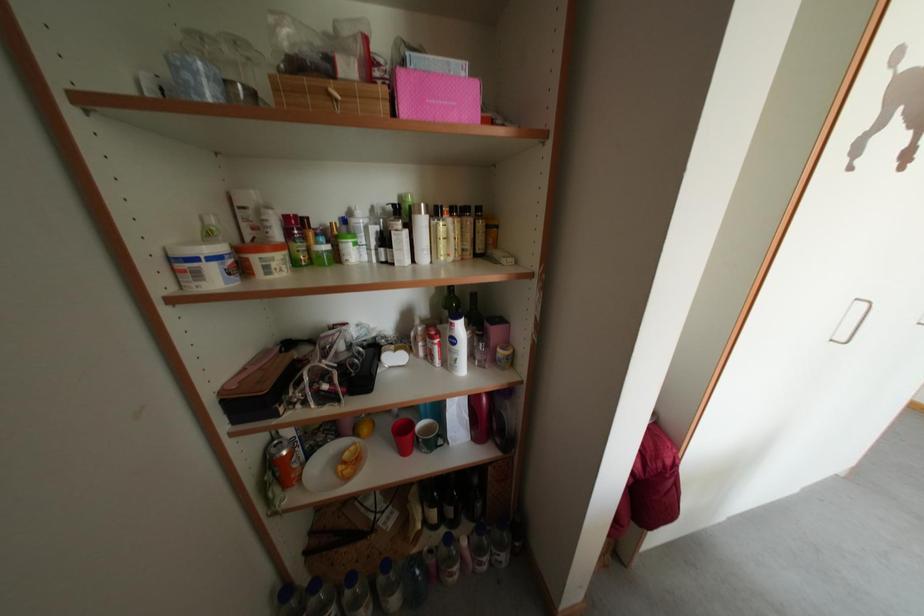
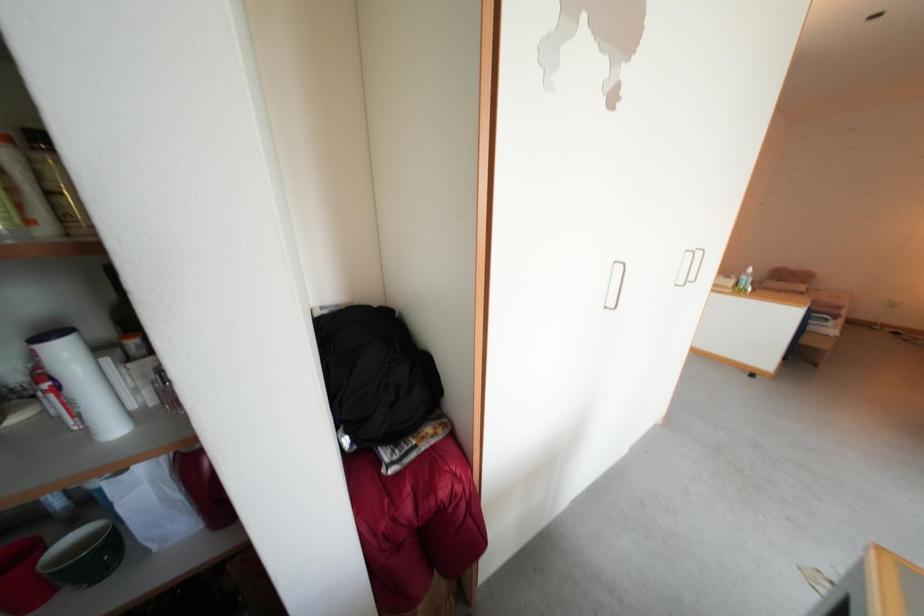
Question: Based on the continuous images, in which direction is the camera rotating? Reply with the corresponding letter.

Choices:
 (A) Left
 (B) Right
 (C) Up
 (D) Down

Answer: (B)